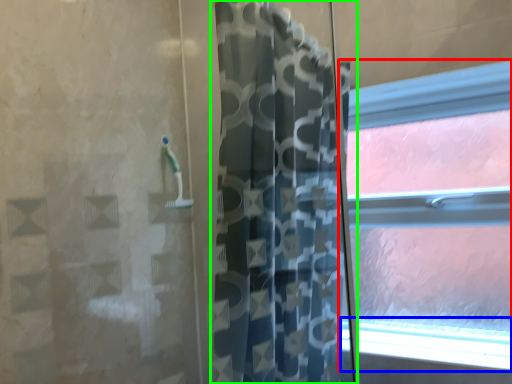
Question: Based on their relative distances, which object is nearer to window (highlighted by a red box)? Choose from window sill (highlighted by a blue box) and curtain (highlighted by a green box).

Choices:
 (A) window sill
 (B) curtain

Answer: (A)